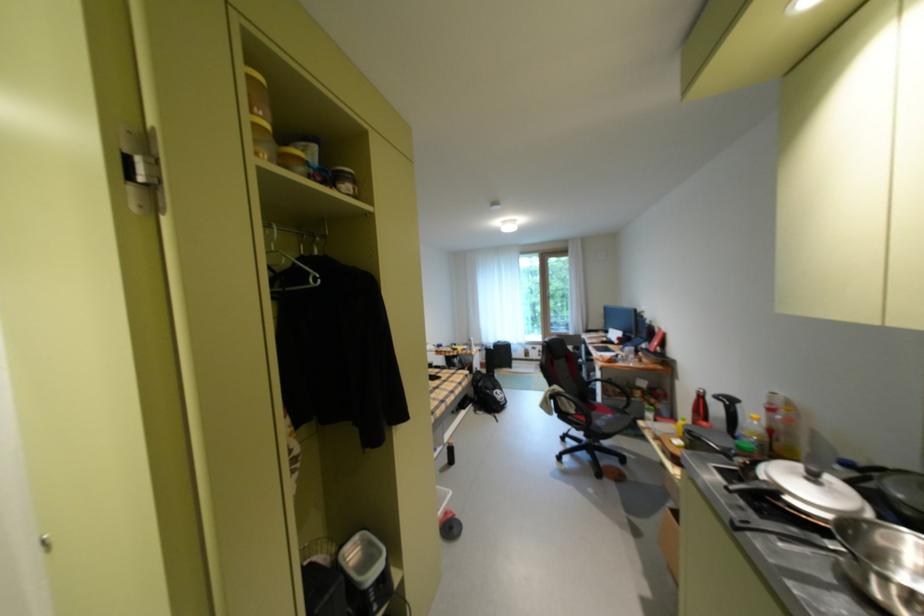
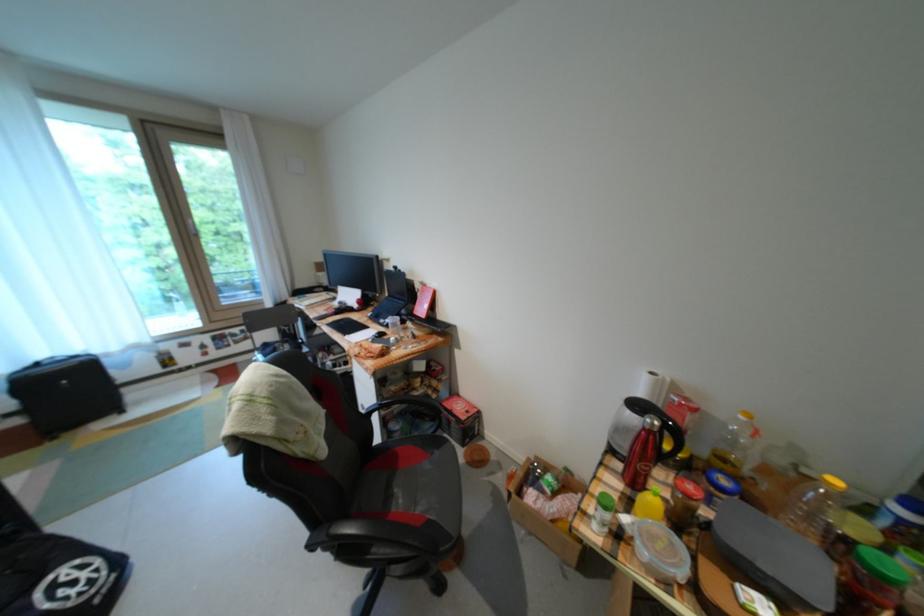
In the second image, find the point that corresponds to [555,293] in the first image.

(195, 223)